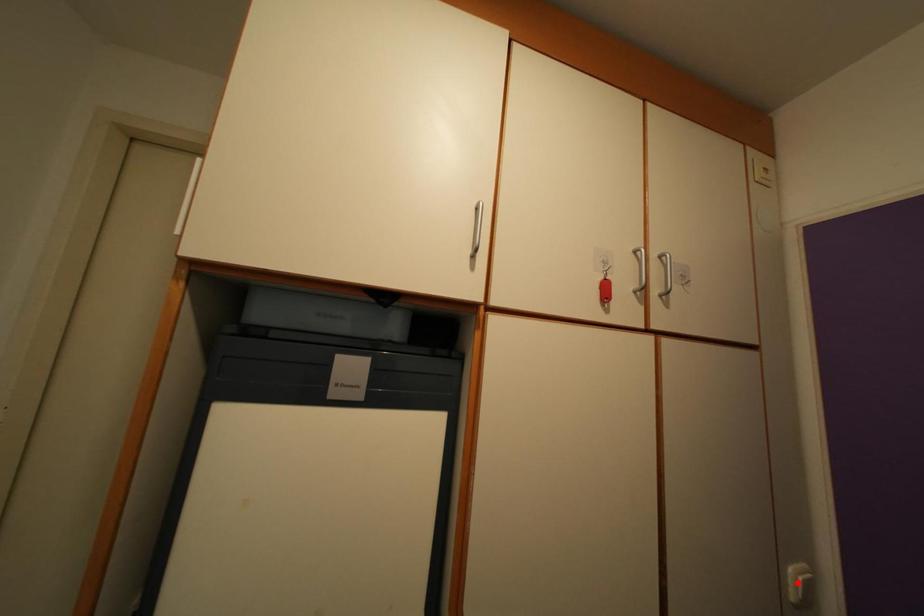
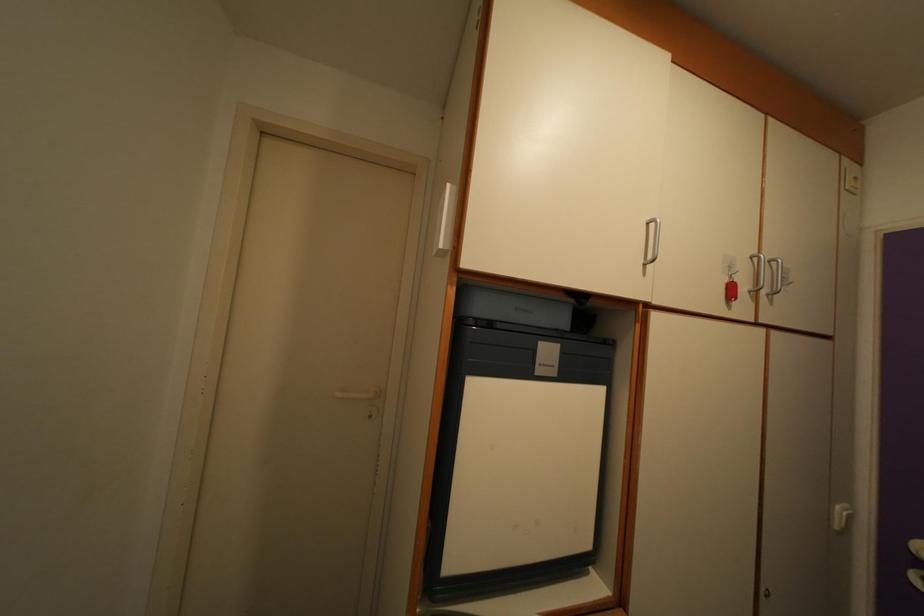
Where in the second image is the point corresponding to the highlighted location from the first image?

(843, 519)